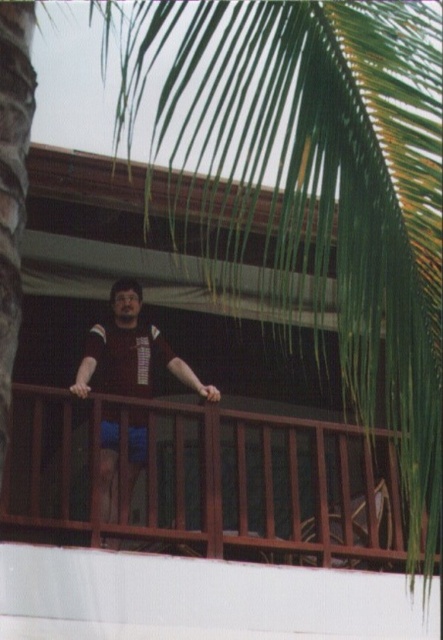
Question: Is brown wooden railing at center positioned at the back of matte black shirt at center?

Choices:
 (A) yes
 (B) no

Answer: (A)

Question: Considering the relative positions of brown wooden railing at center and matte black shirt at center in the image provided, where is brown wooden railing at center located with respect to matte black shirt at center?

Choices:
 (A) above
 (B) below

Answer: (B)

Question: Does brown wooden railing at center have a lesser width compared to matte black shirt at center?

Choices:
 (A) no
 (B) yes

Answer: (B)

Question: Among these points, which one is farthest from the camera?

Choices:
 (A) (177, 368)
 (B) (189, 442)

Answer: (B)

Question: Which point is farther to the camera?

Choices:
 (A) matte black shirt at center
 (B) brown wooden railing at center

Answer: (B)

Question: Which point is closer to the camera taking this photo?

Choices:
 (A) click(237, 493)
 (B) click(138, 310)

Answer: (A)